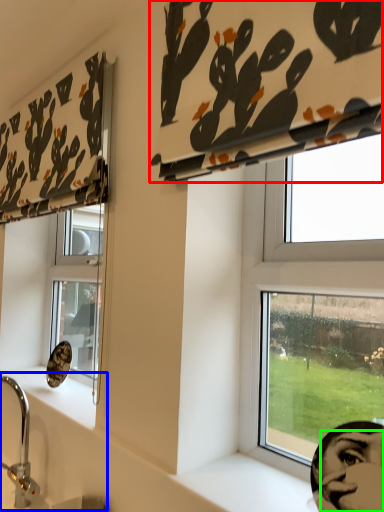
Question: Which is farther away from curtain (highlighted by a red box)? sink (highlighted by a blue box) or human face (highlighted by a green box)?

Choices:
 (A) sink
 (B) human face

Answer: (A)